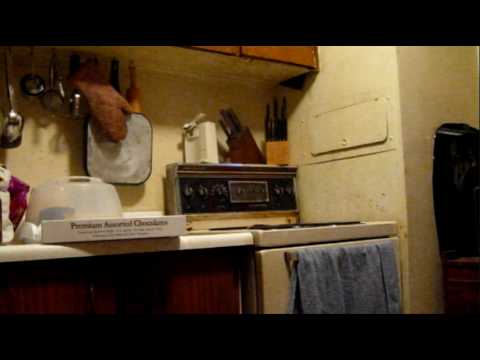
You are a GUI agent. You are given a task and a screenshot of the screen. Output one action in this format:
    pyautogui.click(x=<x>, y=<y>)
    Task: Click on the wall
    Image resolution: width=480 pixels, height=360 pixels.
    Given the screenshot: What is the action you would take?
    pyautogui.click(x=360, y=73), pyautogui.click(x=426, y=72), pyautogui.click(x=412, y=190), pyautogui.click(x=365, y=188), pyautogui.click(x=226, y=104), pyautogui.click(x=176, y=100), pyautogui.click(x=169, y=144), pyautogui.click(x=57, y=151)